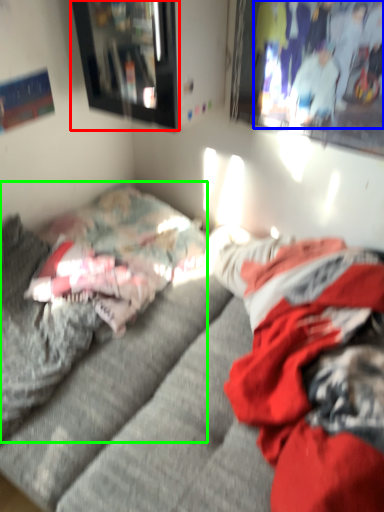
Question: Based on their relative distances, which object is farther from picture frame (highlighted by a red box)? Choose from couple (highlighted by a blue box) and bed (highlighted by a green box).

Choices:
 (A) couple
 (B) bed

Answer: (B)